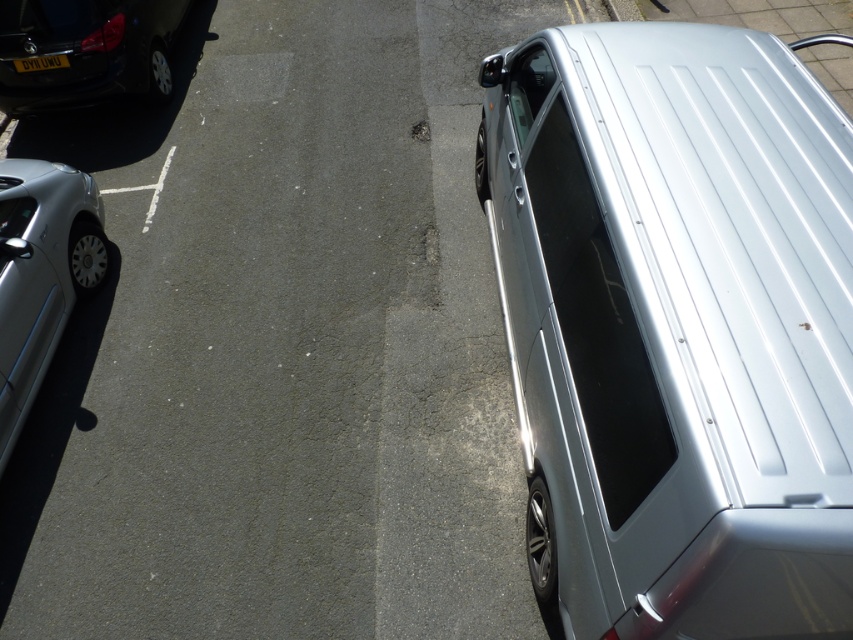
Question: Does metallic silver van at center have a smaller size compared to shiny black car at upper left?

Choices:
 (A) yes
 (B) no

Answer: (A)

Question: Does metallic silver van at center come behind silver metallic hatchback at left?

Choices:
 (A) no
 (B) yes

Answer: (A)

Question: Which point appears farthest from the camera in this image?

Choices:
 (A) (44, 60)
 (B) (33, 74)
 (C) (611, 186)
 (D) (454, 508)

Answer: (B)

Question: Which is nearer to the satin silver van at right?

Choices:
 (A) metallic silver van at center
 (B) shiny black car at upper left

Answer: (A)

Question: Does metallic silver van at center appear over shiny black car at upper left?

Choices:
 (A) no
 (B) yes

Answer: (A)

Question: Among these objects, which one is nearest to the camera?

Choices:
 (A) shiny black car at upper left
 (B) black plastic license plate at upper left
 (C) metallic silver van at center
 (D) silver metallic hatchback at left

Answer: (C)